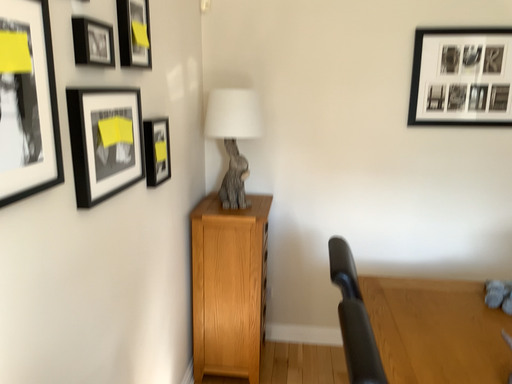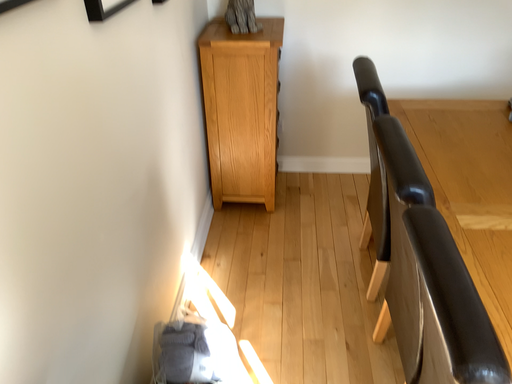
Question: Which way did the camera rotate in the video?

Choices:
 (A) rotated upward
 (B) rotated downward

Answer: (B)